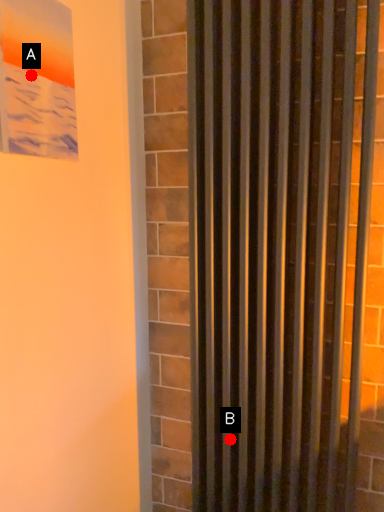
Question: Two points are circled on the image, labeled by A and B beside each circle. Among these points, which one is nearest to the camera?

Choices:
 (A) A is closer
 (B) B is closer

Answer: (A)